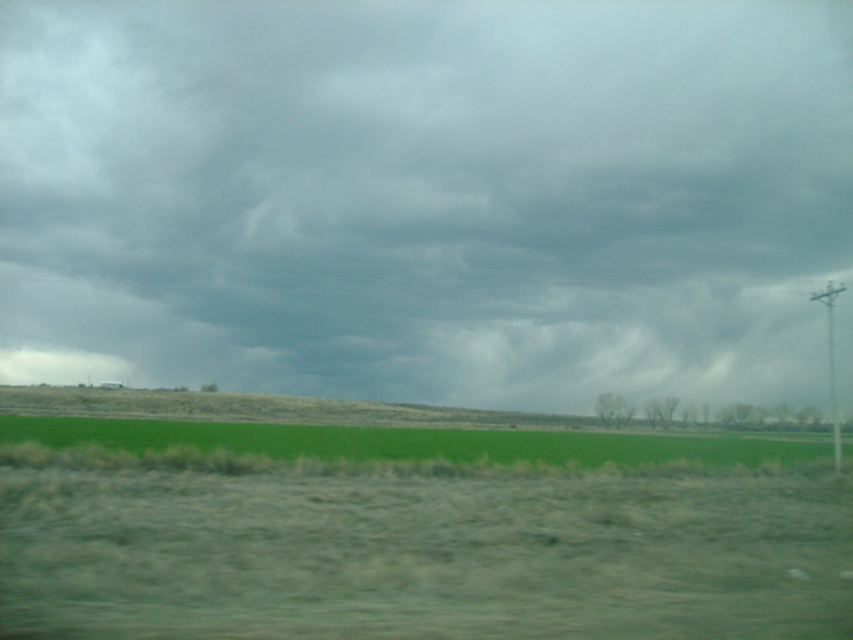
Question: Which is nearer to the dark gray cloud at upper center?

Choices:
 (A) green grass at lower center
 (B) green grass at center

Answer: (A)

Question: Does dark gray cloud at upper center appear on the left side of green grass at center?

Choices:
 (A) yes
 (B) no

Answer: (A)

Question: Is green grass at center positioned behind green grass at lower center?

Choices:
 (A) yes
 (B) no

Answer: (B)

Question: Which point is farther to the camera?

Choices:
 (A) (503, 509)
 (B) (514, 445)

Answer: (B)

Question: Considering the relative positions of green grass at center and green grass at lower center in the image provided, where is green grass at center located with respect to green grass at lower center?

Choices:
 (A) right
 (B) left

Answer: (B)

Question: Which object is farther from the camera taking this photo?

Choices:
 (A) dark gray cloud at upper center
 (B) green grass at lower center

Answer: (A)